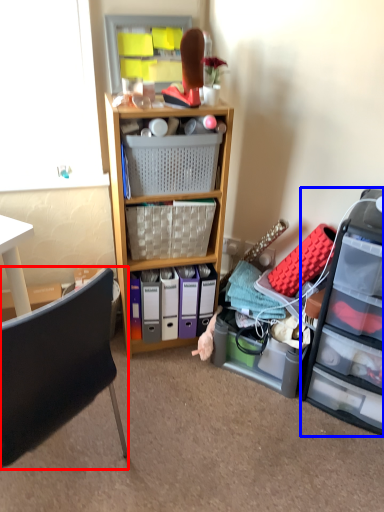
Question: Which object appears closest to the camera in this image, chair (highlighted by a red box) or file cabinet (highlighted by a blue box)?

Choices:
 (A) chair
 (B) file cabinet

Answer: (A)